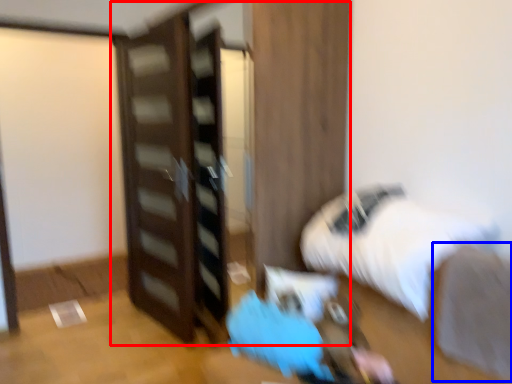
Question: Which of the following is the closest to the observer, dresser (highlighted by a red box) or sheet (highlighted by a blue box)?

Choices:
 (A) dresser
 (B) sheet

Answer: (B)